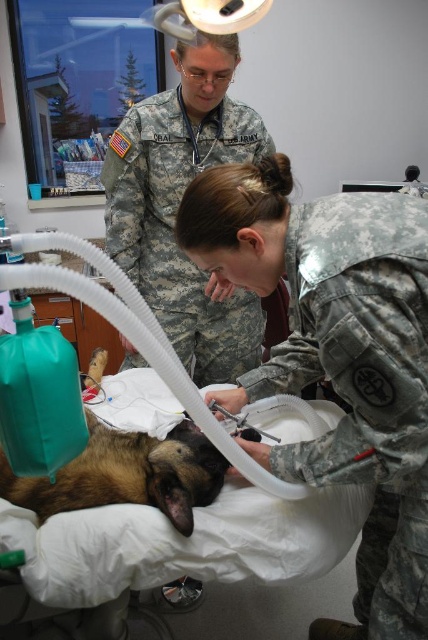
Can you confirm if camouflage uniform at center is positioned to the left of camouflage fabric uniform at upper center?

In fact, camouflage uniform at center is to the right of camouflage fabric uniform at upper center.

Between camouflage uniform at center and camouflage fabric uniform at upper center, which one is positioned lower?

Positioned lower is camouflage uniform at center.

Which is in front, point (427, 476) or point (223, 323)?

Point (427, 476)

In order to click on camouflage uniform at center in this screenshot , I will do `click(336, 353)`.

Can you confirm if camouflage uniform at center is taller than brown fur dog at center?

Indeed, camouflage uniform at center has a greater height compared to brown fur dog at center.

What do you see at coordinates (336, 353) in the screenshot? The image size is (428, 640). I see `camouflage uniform at center` at bounding box center [336, 353].

Locate an element on the screen. The width and height of the screenshot is (428, 640). camouflage uniform at center is located at coordinates (336, 353).

Is camouflage fabric uniform at upper center bigger than brown fur dog at center?

Yes.

Between point (148, 148) and point (109, 440), which one is positioned in front?

Point (109, 440) is in front.

What do you see at coordinates (174, 227) in the screenshot?
I see `camouflage fabric uniform at upper center` at bounding box center [174, 227].

The width and height of the screenshot is (428, 640). I want to click on camouflage fabric uniform at upper center, so click(174, 227).